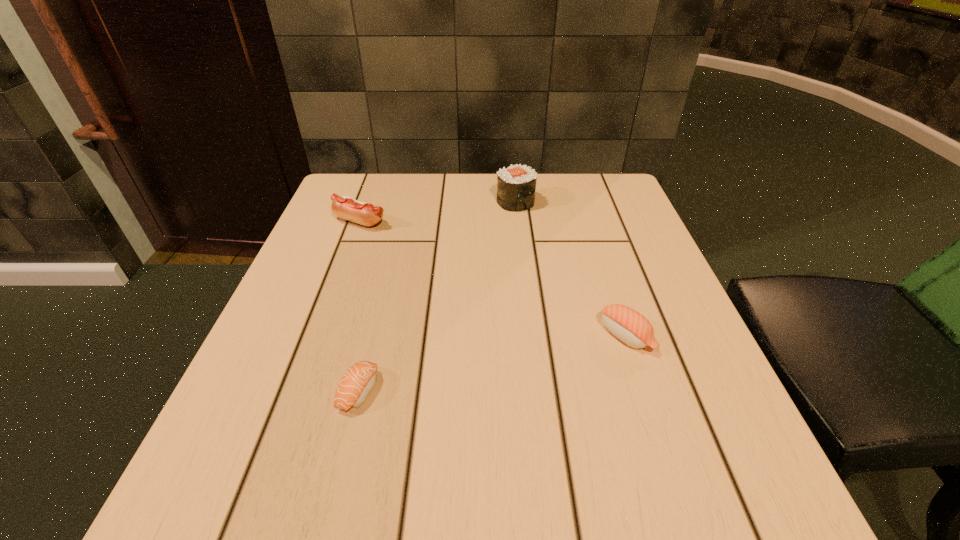
Image resolution: width=960 pixels, height=540 pixels. What are the coordinates of `the second sushi from right to left` in the screenshot? It's located at (x=516, y=185).

The height and width of the screenshot is (540, 960). I want to click on the tallest object, so click(516, 185).

Where is `sausage`? sausage is located at coordinates (367, 214).

Where is `the second shortest sushi`? The height and width of the screenshot is (540, 960). the second shortest sushi is located at coordinates (628, 325).

Locate an element on the screen. the second nearest object is located at coordinates (628, 325).

Identify the location of the nearest object. (358, 381).

You are a GUI agent. You are given a task and a screenshot of the screen. Output one action in this format:
    pyautogui.click(x=<x>, y=<y>)
    Task: Click on the leftmost sushi
    The image size is (960, 540).
    Given the screenshot: What is the action you would take?
    [358, 381]

In order to click on free space located on the right of the second sushi from right to left in this screenshot , I will do `click(591, 202)`.

This screenshot has width=960, height=540. What are the coordinates of `free space located 0.130m on the front of the leftmost object` in the screenshot? It's located at (343, 269).

Locate an element on the screen. The image size is (960, 540). free space located 0.260m on the back of the second nearest sushi is located at coordinates (592, 233).